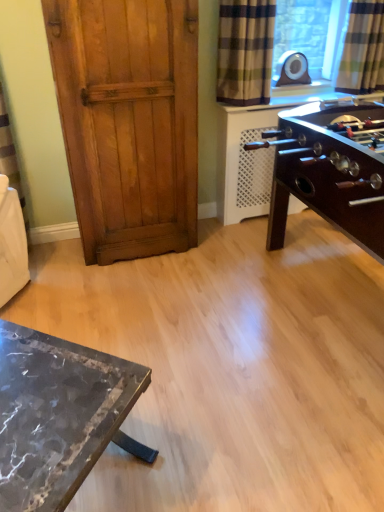
In order to click on spots to the right of wooden door at left in this screenshot , I will do `click(213, 249)`.